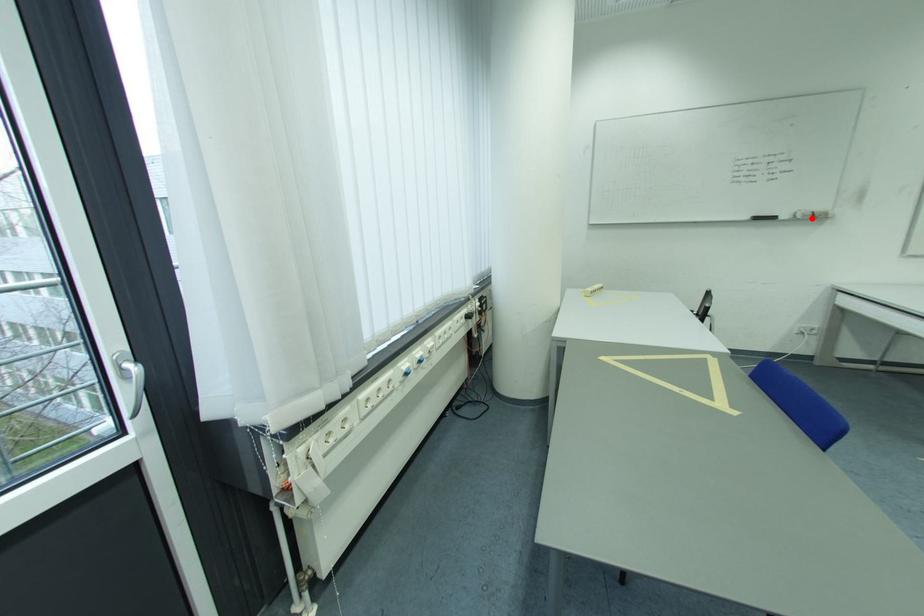
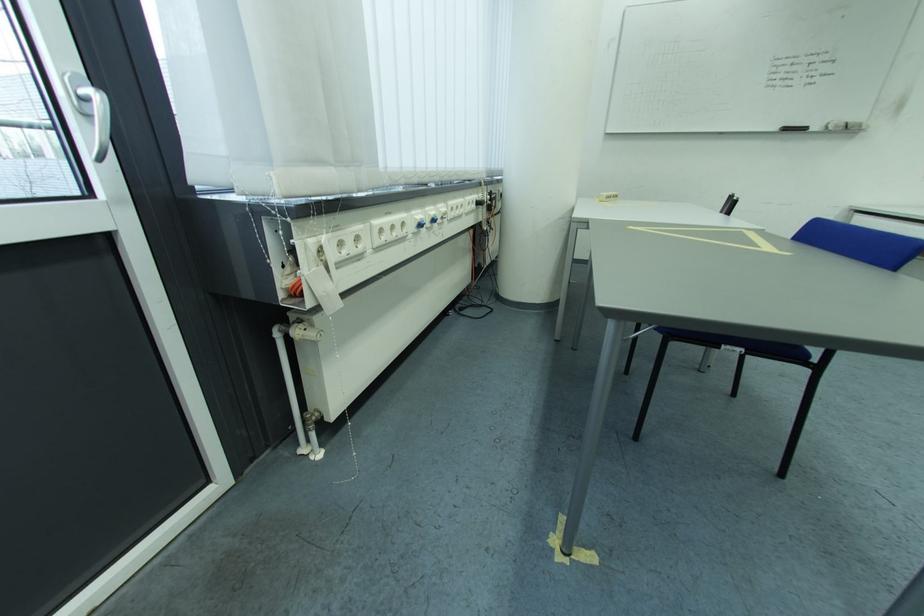
Locate, in the second image, the point that corresponds to the highlighted location in the first image.

(845, 129)